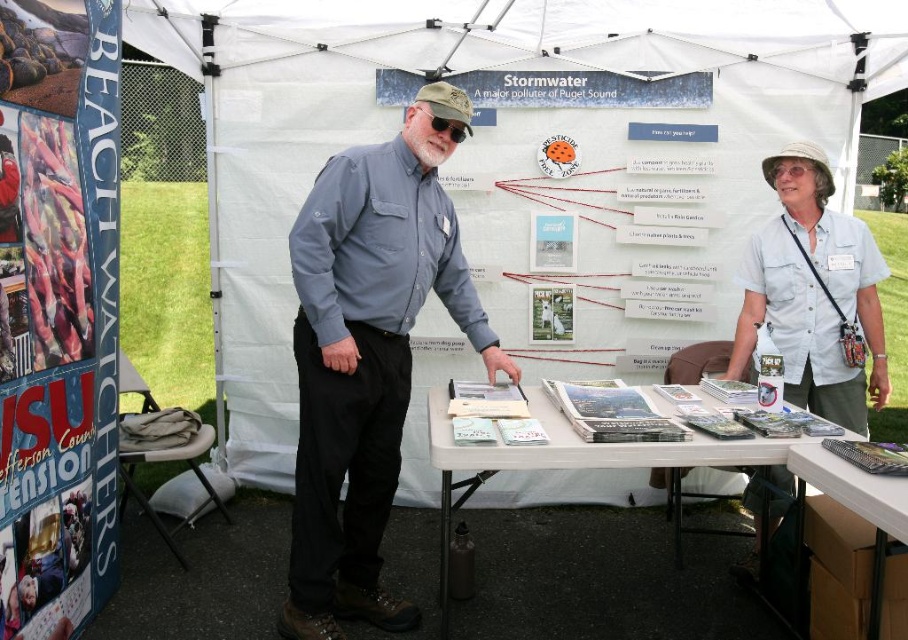
Question: Does white fabric tent at center appear over matte blue shirt at center?

Choices:
 (A) no
 (B) yes

Answer: (B)

Question: Which object is the farthest from the white paper table at center?

Choices:
 (A) blue paper poster at left
 (B) white cotton shirt at upper right
 (C) matte blue shirt at center

Answer: (A)

Question: Does matte blue shirt at center appear on the right side of white paper table at center?

Choices:
 (A) no
 (B) yes

Answer: (A)

Question: Based on their relative distances, which object is nearer to the blue paper poster at left?

Choices:
 (A) matte blue shirt at center
 (B) white paper table at center
 (C) white plastic table at lower right

Answer: (A)

Question: Among these objects, which one is nearest to the camera?

Choices:
 (A) white cotton shirt at upper right
 (B) white plastic table at lower right

Answer: (B)

Question: Can you confirm if blue paper poster at left is positioned below white paper table at center?

Choices:
 (A) no
 (B) yes

Answer: (A)